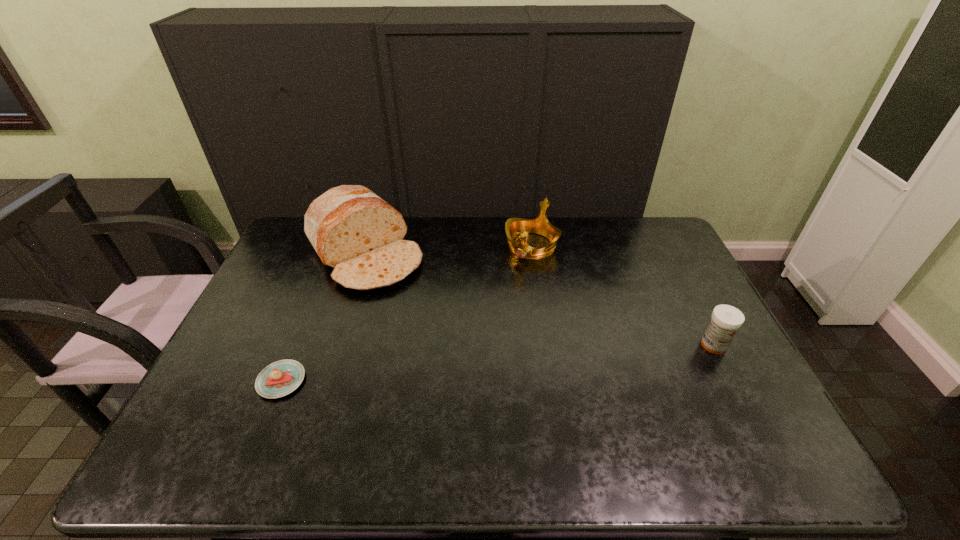
Where is `free space located 0.240m at the front emblem of the tiara`? The height and width of the screenshot is (540, 960). free space located 0.240m at the front emblem of the tiara is located at coordinates (491, 308).

This screenshot has height=540, width=960. I want to click on free space located 0.210m at the sliced end of the tallest object, so click(x=428, y=327).

This screenshot has width=960, height=540. I want to click on free space located at the sliced end of the tallest object, so point(411,307).

Locate an element on the screen. vacant space located at the sliced end of the tallest object is located at coordinates (432, 331).

Where is `tiara located in the far edge section of the desktop`? tiara located in the far edge section of the desktop is located at coordinates (515, 227).

This screenshot has height=540, width=960. Find the location of `bread situated at the far edge`. bread situated at the far edge is located at coordinates (355, 232).

The width and height of the screenshot is (960, 540). Identify the location of object that is at the near edge. (282, 377).

Find the location of a particular element. Image resolution: width=960 pixels, height=540 pixels. pastry that is at the left edge is located at coordinates (282, 377).

You are a GUI agent. You are given a task and a screenshot of the screen. Output one action in this format:
    pyautogui.click(x=<x>, y=<y>)
    Task: Click on the bread that is at the left edge
    This screenshot has width=960, height=540.
    Given the screenshot: What is the action you would take?
    pyautogui.click(x=355, y=232)

Identify the location of object that is at the right edge. Image resolution: width=960 pixels, height=540 pixels. (725, 321).